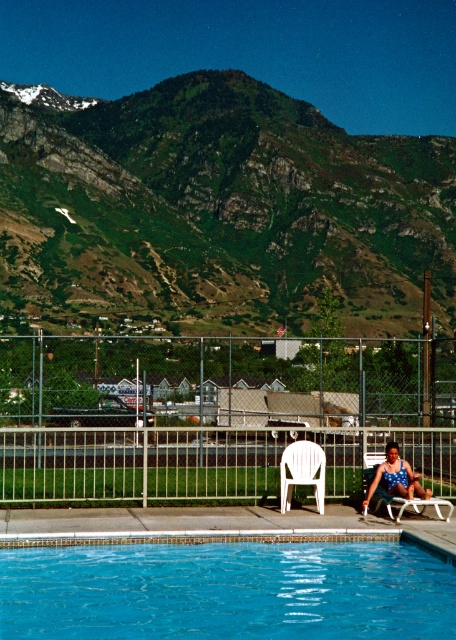
Consider the image. You are a visitor at the pool and want to ensure privacy. The white plastic fence at lower center and the blue dotted swimsuit at lower right are both in your view. Which object is taller and can potentially block the view of the swimsuit?

The white plastic fence at lower center is much taller than the blue dotted swimsuit at lower right, so it can potentially block the view of the swimsuit.

Looking at this image, you are standing at the edge of the pool and want to see both the blue glossy water at center and the blue dotted swimsuit at lower right. Which one will you see first as you look towards the scene?

You will see the blue glossy water at center first because it is positioned in front of the blue dotted swimsuit at lower right.

From the picture: You are standing at the edge of the swimming pool and see the white plastic fence at lower center and the blue dotted swimsuit at lower right. Which object is closer to your right side?

The blue dotted swimsuit at lower right is closer to your right side because the white plastic fence at lower center is to the left of it.